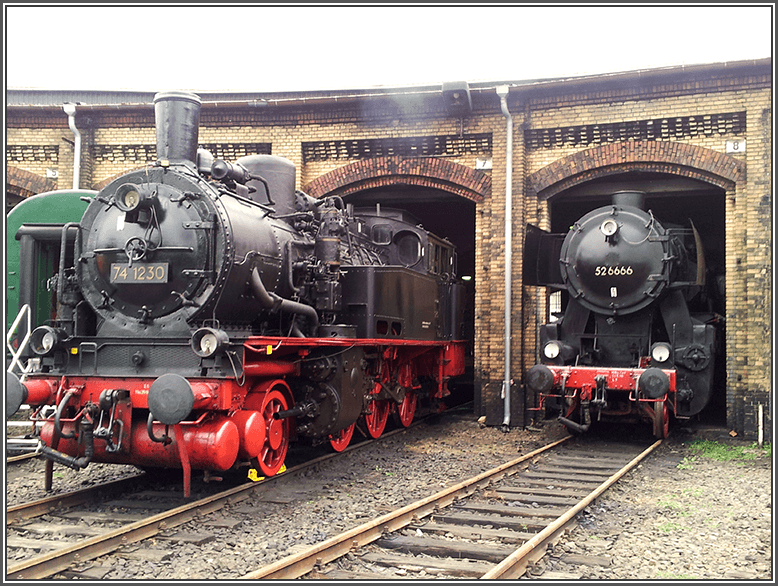
Where is `archway`? The height and width of the screenshot is (586, 778). archway is located at coordinates (626, 151), (397, 170), (19, 177).